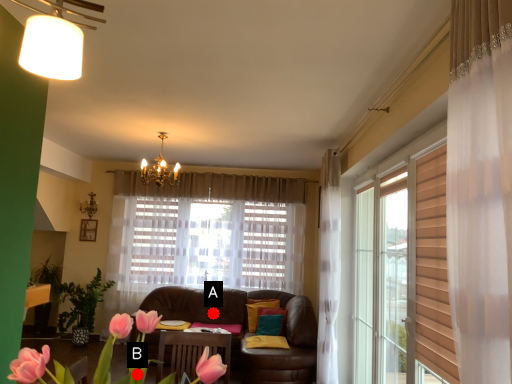
Question: Two points are circled on the image, labeled by A and B beside each circle. Which point is closer to the camera?

Choices:
 (A) A is closer
 (B) B is closer

Answer: (B)